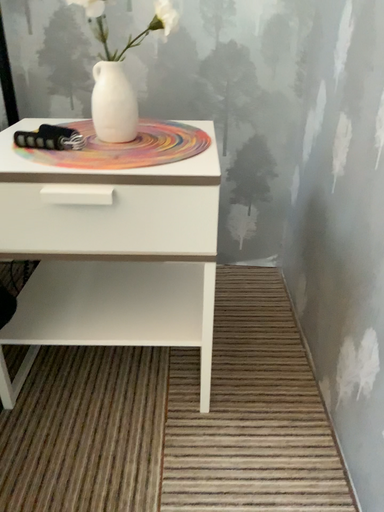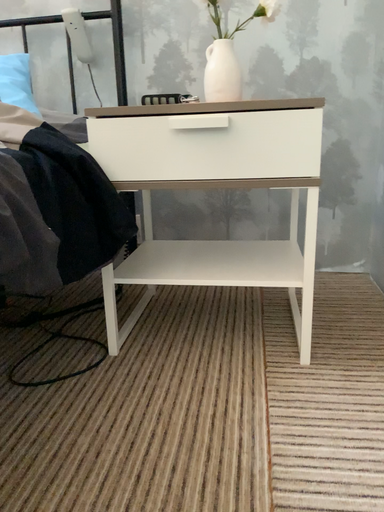
Question: How did the camera likely rotate when shooting the video?

Choices:
 (A) rotated downward
 (B) rotated upward

Answer: (B)